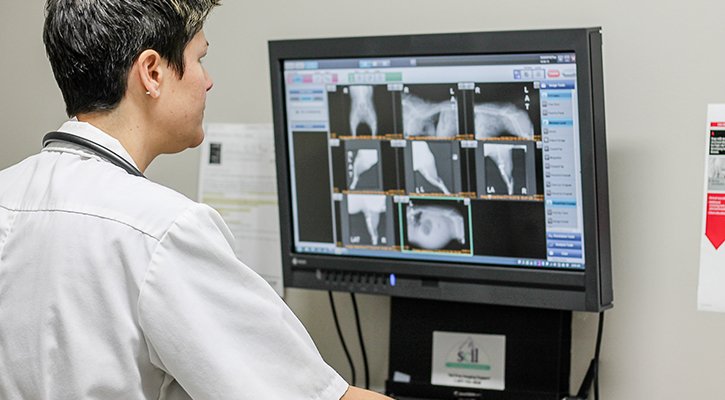
Where is `paper on wall`? Image resolution: width=725 pixels, height=400 pixels. paper on wall is located at coordinates (227, 176), (712, 278).